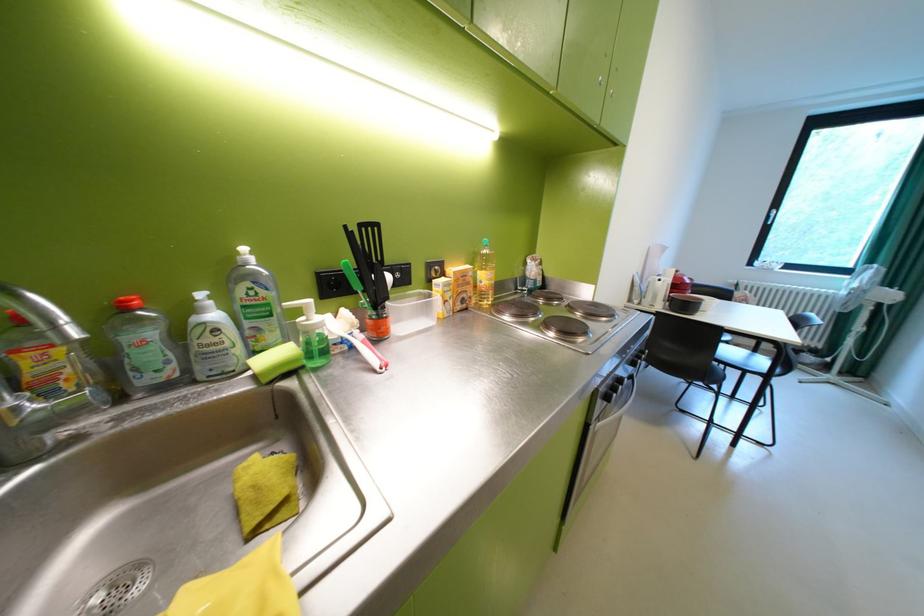
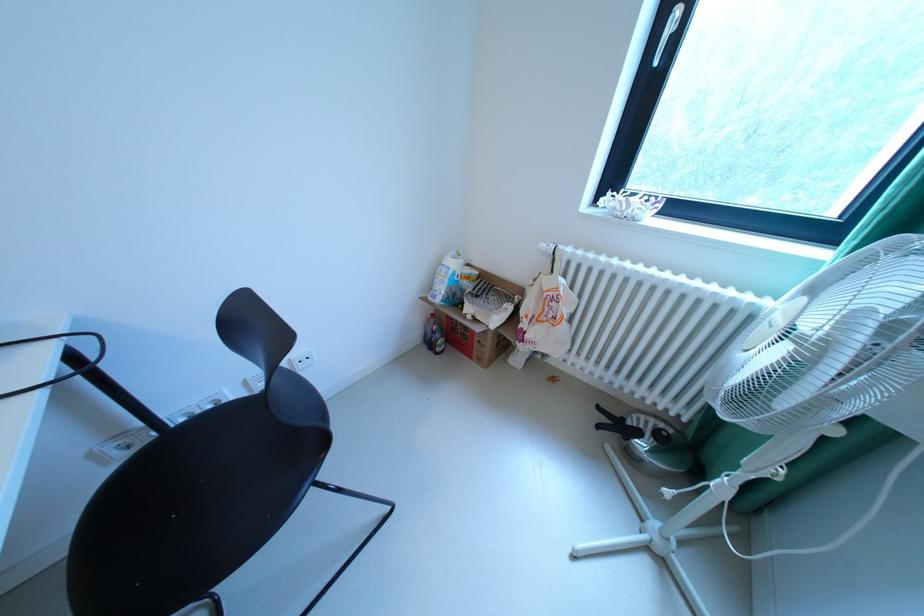
Looking at this image, which direction would the cameraman need to move to produce the second image?

The cameraman walked toward right, forward.